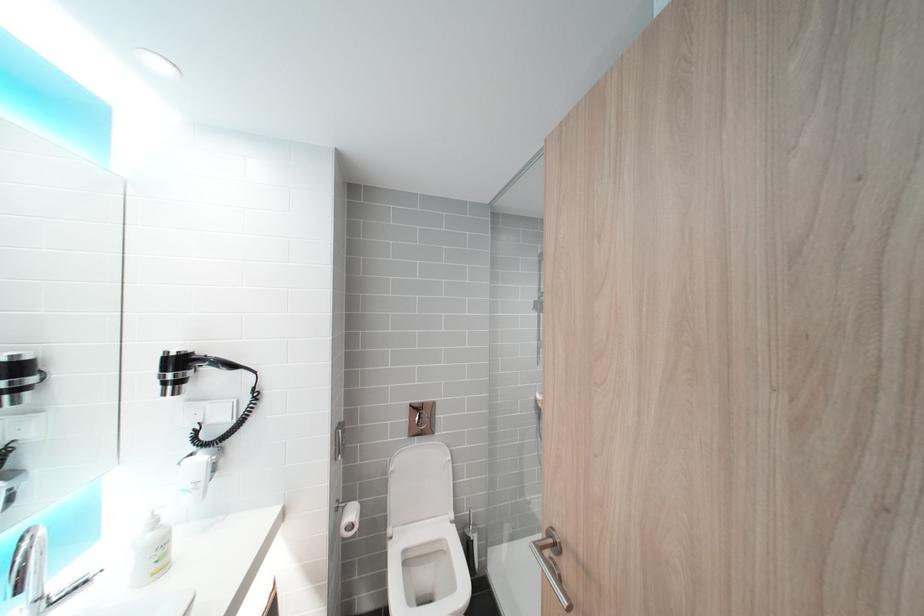
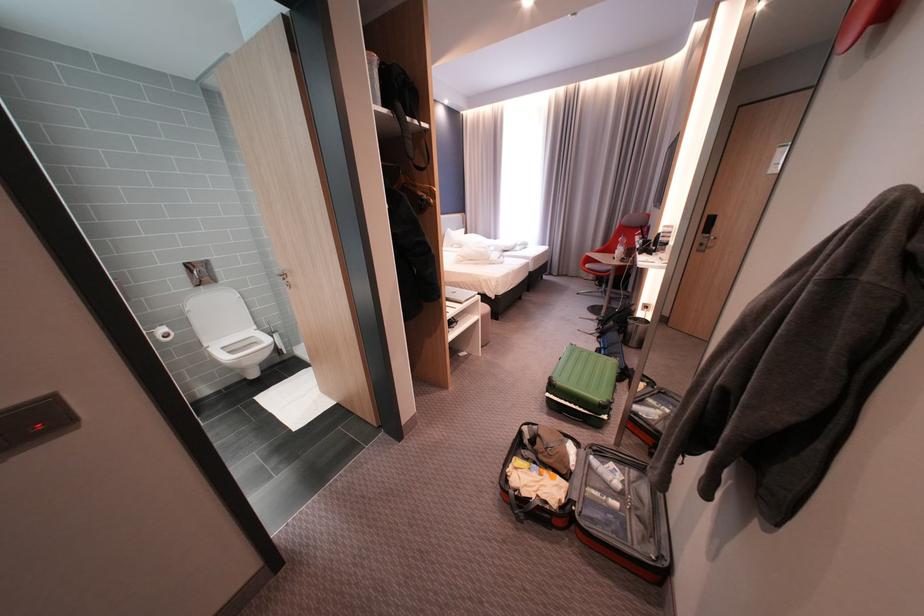
Locate, in the second image, the point that corresponds to [404,472] in the first image.

(201, 312)